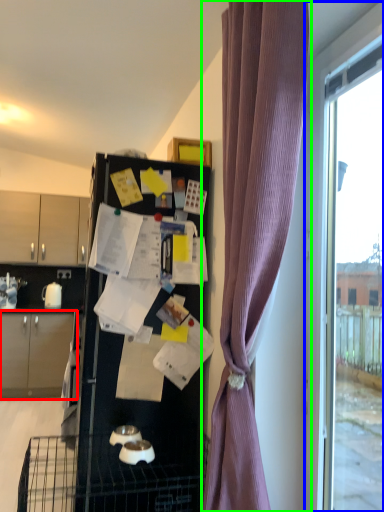
Question: Considering the real-world distances, which object is farthest from cabinetry (highlighted by a red box)? window (highlighted by a blue box) or curtain (highlighted by a green box)?

Choices:
 (A) window
 (B) curtain

Answer: (A)